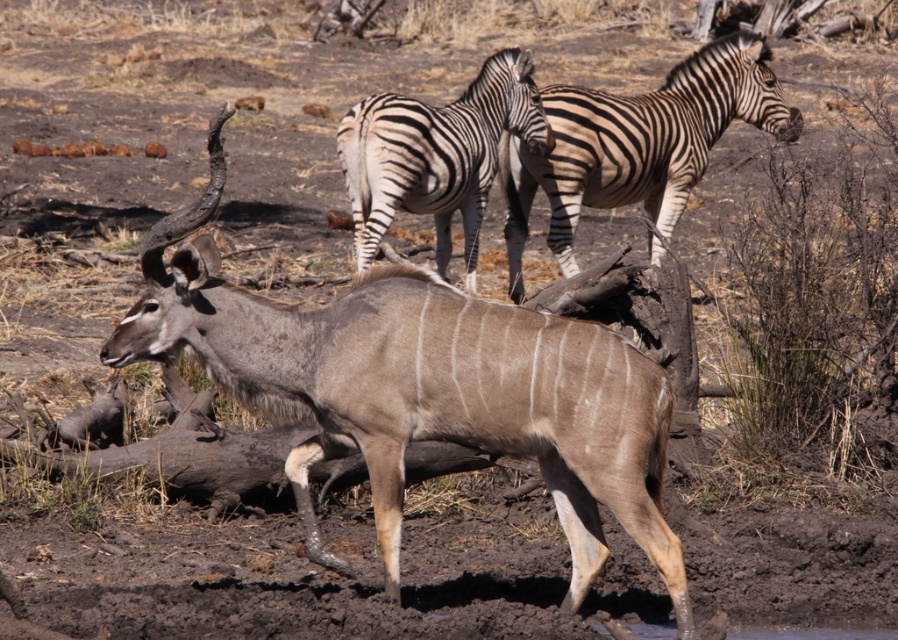
Is gray textured antelope at center in front of black and white striped zebra at upper center?

Yes, gray textured antelope at center is closer to the viewer.

Between point (142, 250) and point (720, 83), which one is positioned in front?

Point (142, 250) is in front.

This screenshot has width=898, height=640. In order to click on gray textured antelope at center in this screenshot , I will do `click(421, 388)`.

Can you confirm if gray textured antelope at center is wider than black and white striped zebra at center?

Yes, gray textured antelope at center is wider than black and white striped zebra at center.

Locate an element on the screen. This screenshot has width=898, height=640. gray textured antelope at center is located at coordinates (421, 388).

You are a GUI agent. You are given a task and a screenshot of the screen. Output one action in this format:
    pyautogui.click(x=<x>, y=<y>)
    Task: Click on the gray textured antelope at center
    This screenshot has width=898, height=640.
    Given the screenshot: What is the action you would take?
    pyautogui.click(x=421, y=388)

Can you confirm if black and white striped zebra at upper center is positioned above black and white striped zebra at center?

Indeed, black and white striped zebra at upper center is positioned over black and white striped zebra at center.

Who is positioned more to the left, black and white striped zebra at upper center or black and white striped zebra at center?

From the viewer's perspective, black and white striped zebra at center appears more on the left side.

I want to click on black and white striped zebra at upper center, so click(x=637, y=145).